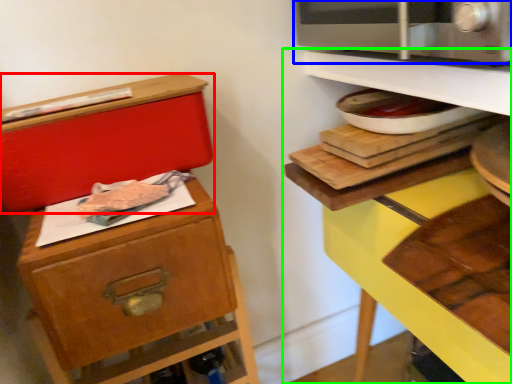
Question: Considering the real-world distances, which object is closest to box (highlighted by a red box)? microwave oven (highlighted by a blue box) or shelf (highlighted by a green box).

Choices:
 (A) microwave oven
 (B) shelf

Answer: (B)